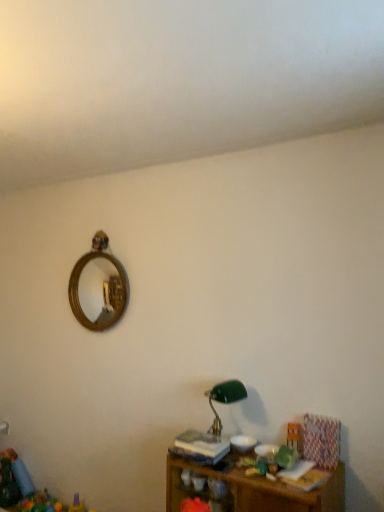
Find the location of a particular element. This screenshot has width=384, height=512. vacant area on top of wooden shelf at lower right (from a real-world perspective) is located at coordinates (266, 458).